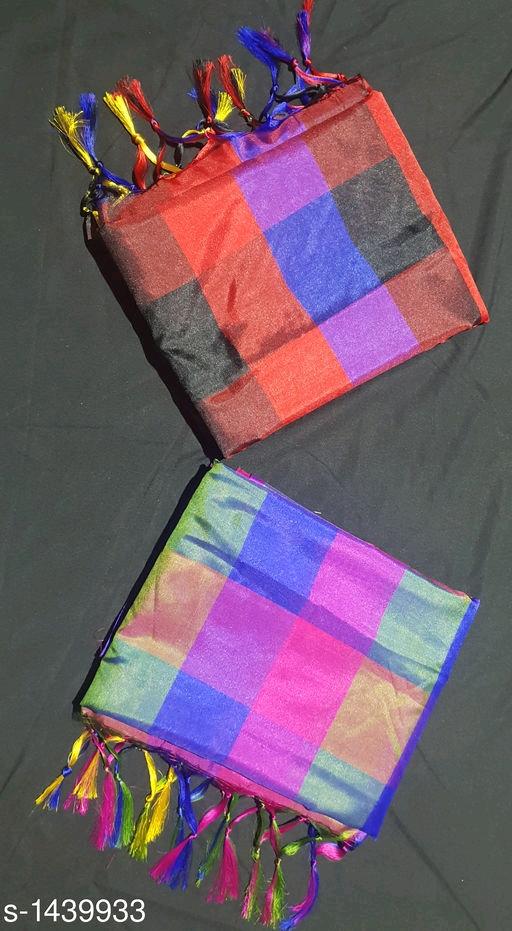
Find the location of a particular element. The height and width of the screenshot is (931, 512). tassle is located at coordinates (298, 902), (275, 898), (261, 897), (221, 884), (170, 860), (147, 830), (116, 816), (89, 776), (70, 760).